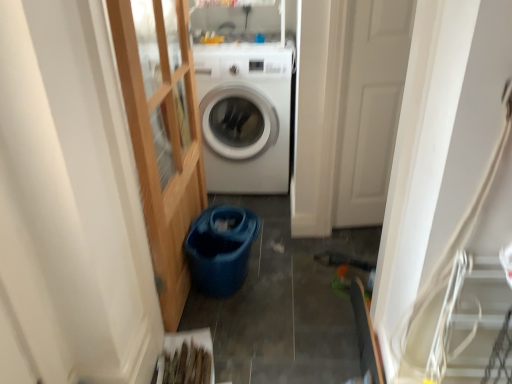
Question: Is white glossy washing machine at center facing towards white matte door at center?

Choices:
 (A) no
 (B) yes

Answer: (A)

Question: Considering the relative sizes of white glossy washing machine at center and white matte door at center in the image provided, is white glossy washing machine at center taller than white matte door at center?

Choices:
 (A) yes
 (B) no

Answer: (B)

Question: Considering the relative sizes of white glossy washing machine at center and white matte door at center in the image provided, is white glossy washing machine at center bigger than white matte door at center?

Choices:
 (A) yes
 (B) no

Answer: (A)

Question: Can you confirm if white glossy washing machine at center is positioned to the right of white matte door at center?

Choices:
 (A) yes
 (B) no

Answer: (B)

Question: Is white glossy washing machine at center closer to camera compared to white matte door at center?

Choices:
 (A) yes
 (B) no

Answer: (B)

Question: Considering the relative sizes of white glossy washing machine at center and white matte door at center in the image provided, is white glossy washing machine at center smaller than white matte door at center?

Choices:
 (A) no
 (B) yes

Answer: (A)

Question: Does white matte door at center come in front of white glossy washing machine at center?

Choices:
 (A) no
 (B) yes

Answer: (B)

Question: Is white matte door at center taller than white glossy washing machine at center?

Choices:
 (A) no
 (B) yes

Answer: (B)

Question: Is white matte door at center looking in the opposite direction of white glossy washing machine at center?

Choices:
 (A) yes
 (B) no

Answer: (B)

Question: Can you confirm if white matte door at center is smaller than white glossy washing machine at center?

Choices:
 (A) no
 (B) yes

Answer: (B)

Question: Considering the relative positions of white matte door at center and white glossy washing machine at center in the image provided, is white matte door at center to the right of white glossy washing machine at center from the viewer's perspective?

Choices:
 (A) no
 (B) yes

Answer: (B)

Question: From a real-world perspective, is white matte door at center beneath white glossy washing machine at center?

Choices:
 (A) yes
 (B) no

Answer: (B)

Question: Is white matte door at center located within clear glass door at left?

Choices:
 (A) no
 (B) yes

Answer: (A)